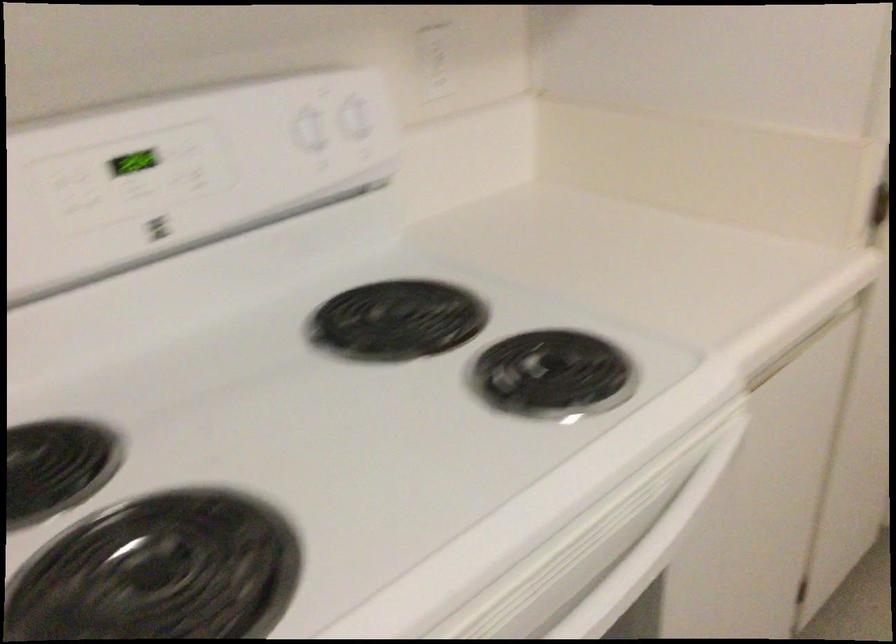
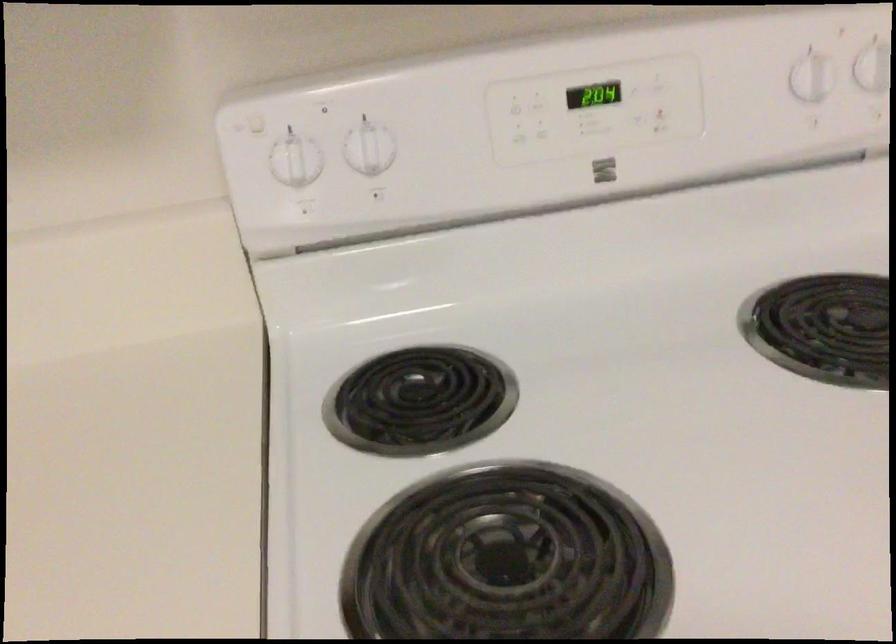
The point at (90, 185) is marked in the first image. Where is the corresponding point in the second image?

(538, 106)